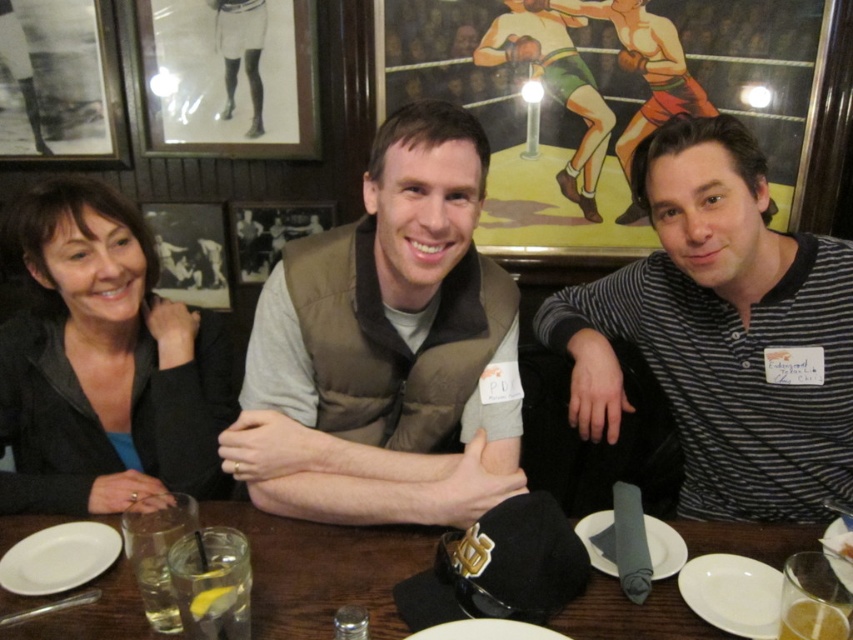
You are a photographer trying to capture a group photo of the three people at the wooden table. You need to ensure that both the brown fuzzy vest at center and the metallic silver picture frame at upper left are visible in the shot. Based on their thickness, which object will appear more prominent in the photo?

The metallic silver picture frame at upper left is thicker than the brown fuzzy vest at center, so it will appear more prominent in the photo.

You are a photographer setting up for a group photo. You need to position the brown fuzzy vest at center so it is visible in the shot. The metallic silver picture frame at upper left is part of the background and should not be in the photo. How should you adjust the camera angle?

To ensure the brown fuzzy vest at center is visible while excluding the metallic silver picture frame at upper left, adjust the camera angle downward since the brown fuzzy vest at center is located below the metallic silver picture frame at upper left.